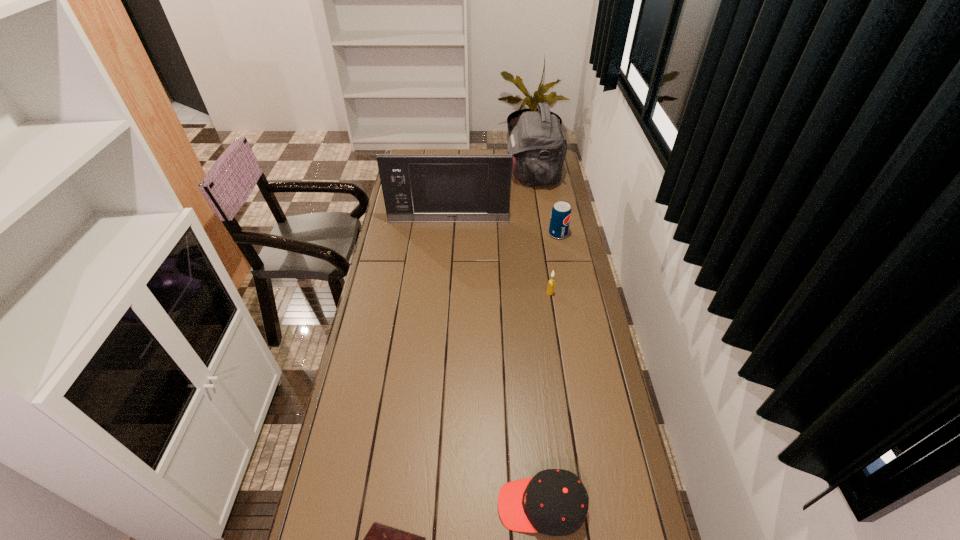
Find the location of a particular element. The image size is (960, 540). vacant area located on the left of the fourth nearest object is located at coordinates (501, 234).

This screenshot has width=960, height=540. In order to click on vacant region located on the back of the fourth farthest object in this screenshot , I will do `click(545, 262)`.

Identify the location of vacant space positioned 0.280m on the front-facing side of the fifth tallest object. This screenshot has height=540, width=960. click(x=393, y=505).

Find the location of `free spot located on the front-facing side of the fifth tallest object`. free spot located on the front-facing side of the fifth tallest object is located at coordinates (475, 505).

Locate an element on the screen. vacant region located 0.080m on the front-facing side of the fifth tallest object is located at coordinates (468, 505).

Where is `object located at the far edge`? object located at the far edge is located at coordinates (539, 146).

This screenshot has height=540, width=960. What are the coordinates of `object that is at the left edge` in the screenshot? It's located at (470, 188).

The image size is (960, 540). I want to click on shoulder bag at the right edge, so click(x=539, y=146).

This screenshot has width=960, height=540. I want to click on pop positioned at the right edge, so click(x=561, y=212).

At what (x,y) coordinates should I click in order to perform the action: click on candle positioned at the right edge. Please return your answer as a coordinate pair (x, y). Looking at the image, I should click on (551, 283).